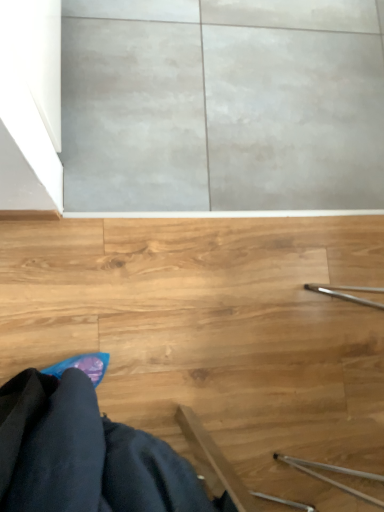
Question: In terms of width, does black fabric robe at lower left look wider or thinner when compared to wooden stairs at lower right?

Choices:
 (A) wide
 (B) thin

Answer: (B)

Question: From a real-world perspective, is black fabric robe at lower left physically located above or below wooden stairs at lower right?

Choices:
 (A) above
 (B) below

Answer: (A)

Question: Is black fabric robe at lower left in front of or behind wooden stairs at lower right in the image?

Choices:
 (A) front
 (B) behind

Answer: (A)

Question: Considering the relative positions of wooden stairs at lower right and black fabric robe at lower left in the image provided, is wooden stairs at lower right to the left or to the right of black fabric robe at lower left?

Choices:
 (A) left
 (B) right

Answer: (B)

Question: Would you say wooden stairs at lower right is inside or outside black fabric robe at lower left?

Choices:
 (A) outside
 (B) inside

Answer: (A)

Question: Is wooden stairs at lower right bigger or smaller than black fabric robe at lower left?

Choices:
 (A) big
 (B) small

Answer: (A)

Question: Is point (347, 359) positioned closer to the camera than point (21, 482)?

Choices:
 (A) closer
 (B) farther

Answer: (B)